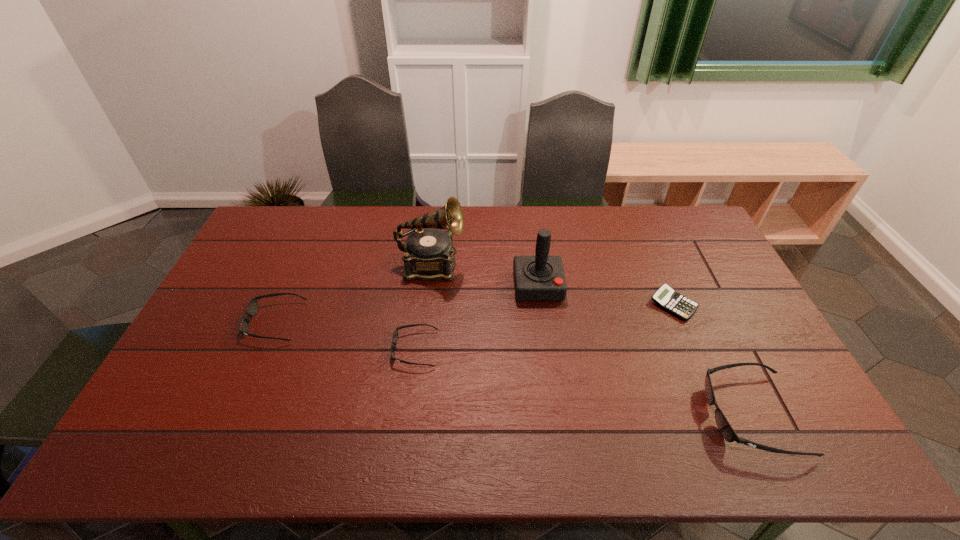
This screenshot has width=960, height=540. Identify the location of free space between the fifth shortest object and the rightmost sunglasses. click(x=644, y=350).

Where is `empty space that is in between the fourth tallest object and the nearest sunglasses`? This screenshot has height=540, width=960. empty space that is in between the fourth tallest object and the nearest sunglasses is located at coordinates (513, 368).

Image resolution: width=960 pixels, height=540 pixels. I want to click on empty space between the tallest object and the third tallest object, so click(x=591, y=340).

This screenshot has height=540, width=960. In order to click on the fourth closest object relative to the tallest object in this screenshot , I will do `click(665, 297)`.

Point out which object is positioned as the fourth nearest to the tallest object. Please provide its 2D coordinates. Your answer should be formatted as a tuple, i.e. [(x, y)], where the tuple contains the x and y coordinates of a point satisfying the conditions above.

[(665, 297)]

The height and width of the screenshot is (540, 960). I want to click on sunglasses identified as the closest to the shortest object, so click(726, 430).

Locate an element on the screen. sunglasses that can be found as the closest to the second tallest sunglasses is located at coordinates (395, 335).

Locate an element on the screen. Image resolution: width=960 pixels, height=540 pixels. vacant space that satisfies the following two spatial constraints: 1. on the base of the fourth object from left to right; 2. on the right side of the shortest object is located at coordinates 540,305.

The image size is (960, 540). In order to click on vacant point that satisfies the following two spatial constraints: 1. on the base of the shortest object; 2. on the left side of the fourth object from left to right in this screenshot , I will do `click(540, 305)`.